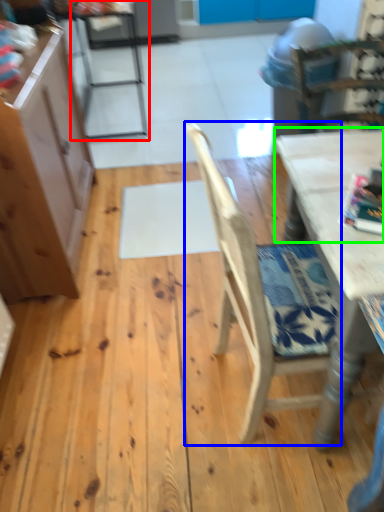
Question: Considering the real-world distances, which object is closest to chair (highlighted by a red box)? chair (highlighted by a blue box) or table top (highlighted by a green box).

Choices:
 (A) chair
 (B) table top

Answer: (B)